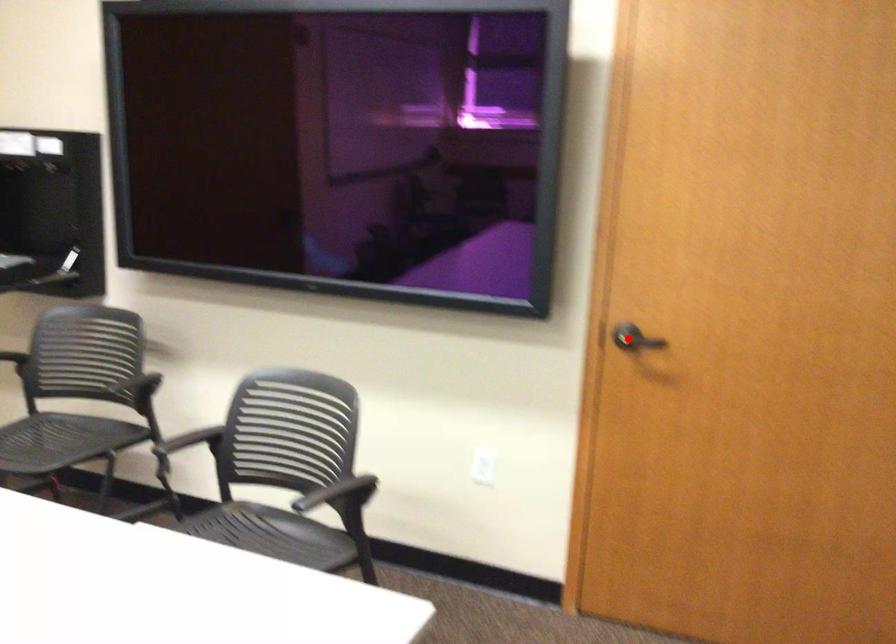
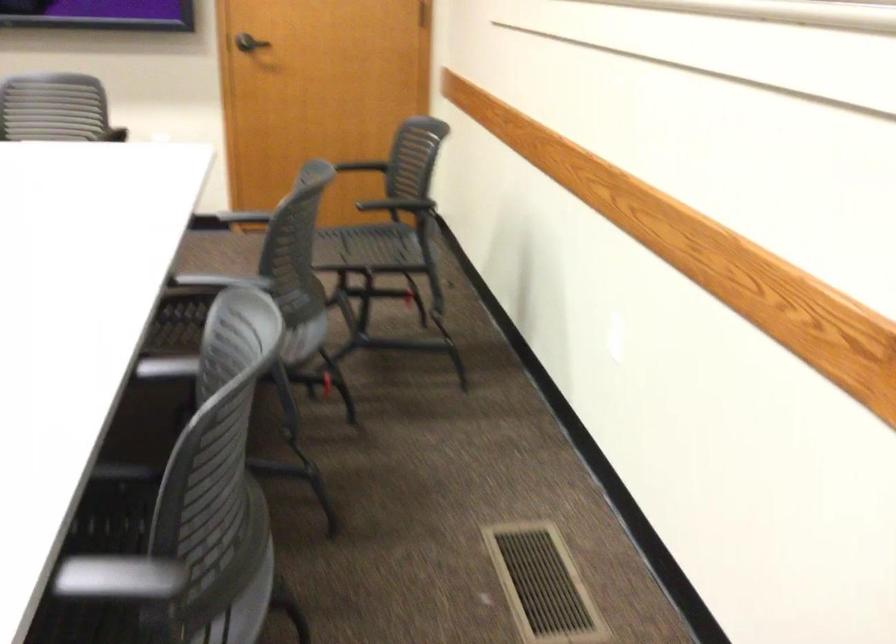
Question: I am providing you with two images of the same scene from different viewpoints. In image1, a red point is highlighted. Considering the same 3D point in image2, which of the following is correct?

Choices:
 (A) It is closer
 (B) It is farther

Answer: (B)